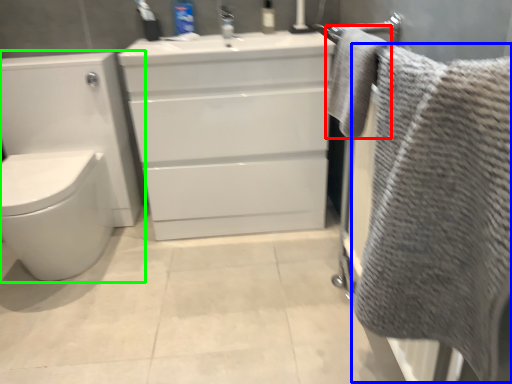
Question: Estimate the real-world distances between objects in this image. Which object is farther from bath towel (highlighted by a red box), bath towel (highlighted by a blue box) or toilet (highlighted by a green box)?

Choices:
 (A) bath towel
 (B) toilet

Answer: (B)